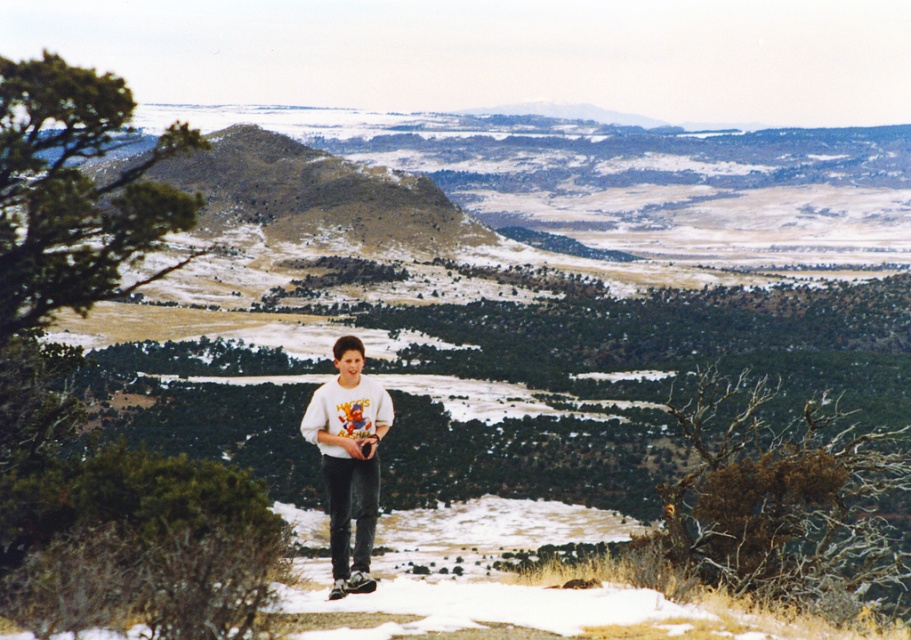
Which is above, white cotton shirt at center or white cotton t-shirt at center?

white cotton t-shirt at center is higher up.

Does white cotton shirt at center have a smaller size compared to white cotton t-shirt at center?

No.

Image resolution: width=911 pixels, height=640 pixels. I want to click on white cotton shirt at center, so click(349, 460).